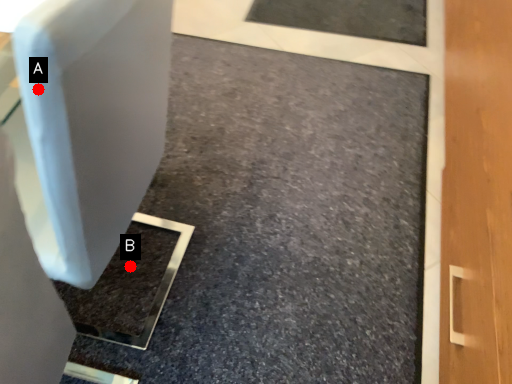
Question: Two points are circled on the image, labeled by A and B beside each circle. Which point is closer to the camera?

Choices:
 (A) A is closer
 (B) B is closer

Answer: (A)